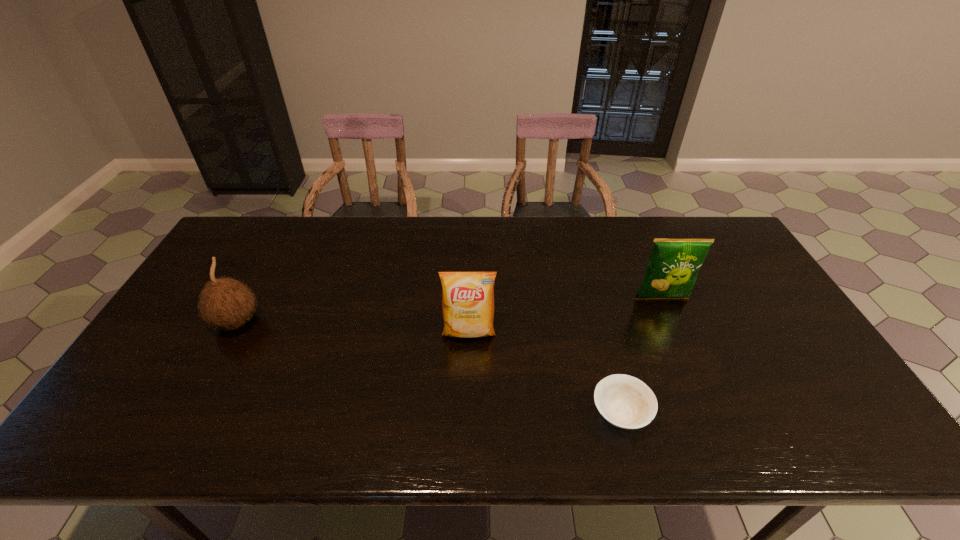
This screenshot has width=960, height=540. I want to click on free space between the left crisp (potato chip) and the bowl, so click(544, 373).

Find the location of a particular element. vacant area between the left crisp (potato chip) and the rightmost object is located at coordinates (565, 315).

Identify the location of empty space that is in between the leftmost object and the bowl. The width and height of the screenshot is (960, 540). (429, 368).

Image resolution: width=960 pixels, height=540 pixels. What are the coordinates of `free space between the coconut and the nearest object` in the screenshot? It's located at (429, 368).

I want to click on free space that is in between the rightmost object and the nearer crisp (potato chip), so click(x=565, y=315).

Find the location of a particular element. vacant area that lies between the right crisp (potato chip) and the nearer crisp (potato chip) is located at coordinates (565, 315).

This screenshot has width=960, height=540. I want to click on unoccupied position between the bowl and the left crisp (potato chip), so click(x=544, y=373).

You are a GUI agent. You are given a task and a screenshot of the screen. Output one action in this format:
    pyautogui.click(x=<x>, y=<y>)
    Task: Click on the unoccupied position between the left crisp (potato chip) and the right crisp (potato chip)
    The image size is (960, 540).
    Given the screenshot: What is the action you would take?
    pyautogui.click(x=565, y=315)

Select which object appears as the second closest to the nearer crisp (potato chip). Please provide its 2D coordinates. Your answer should be formatted as a tuple, i.e. [(x, y)], where the tuple contains the x and y coordinates of a point satisfying the conditions above.

[(673, 266)]

Select which object appears as the closest to the bowl. Please provide its 2D coordinates. Your answer should be formatted as a tuple, i.e. [(x, y)], where the tuple contains the x and y coordinates of a point satisfying the conditions above.

[(467, 297)]